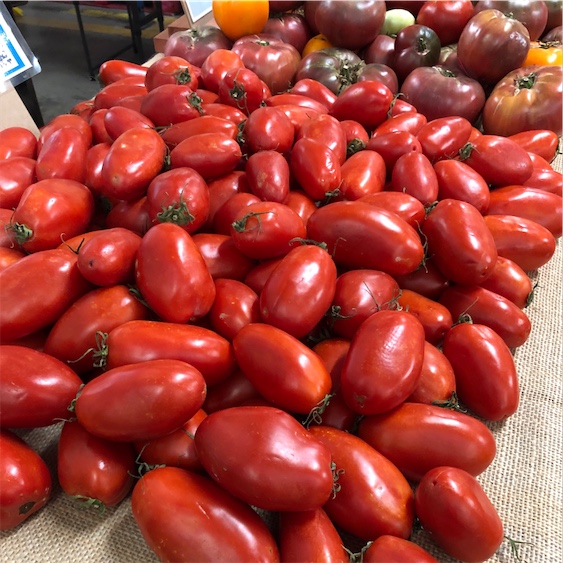
Find the location of a particular element. This screenshot has height=563, width=563. small wooden plank is located at coordinates (165, 38), (171, 28).